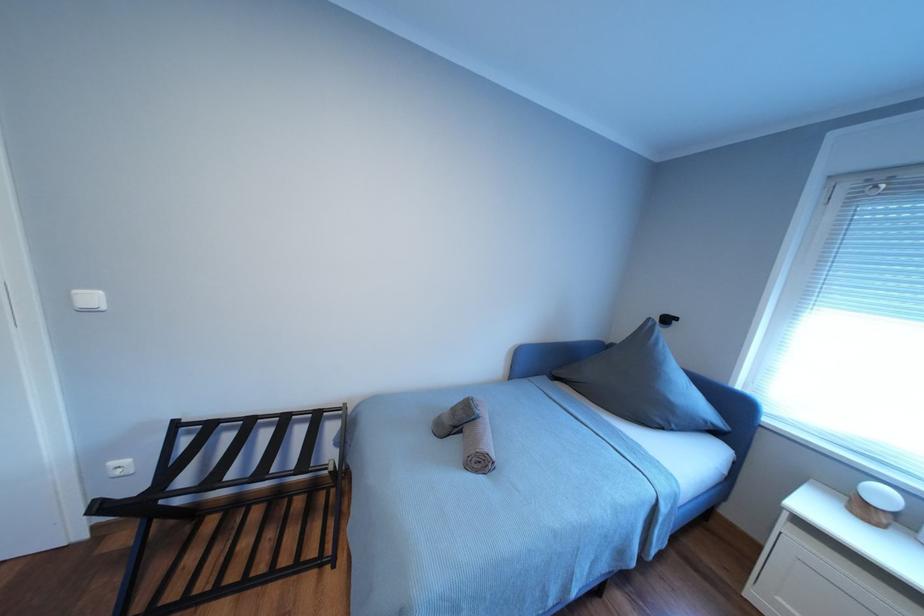
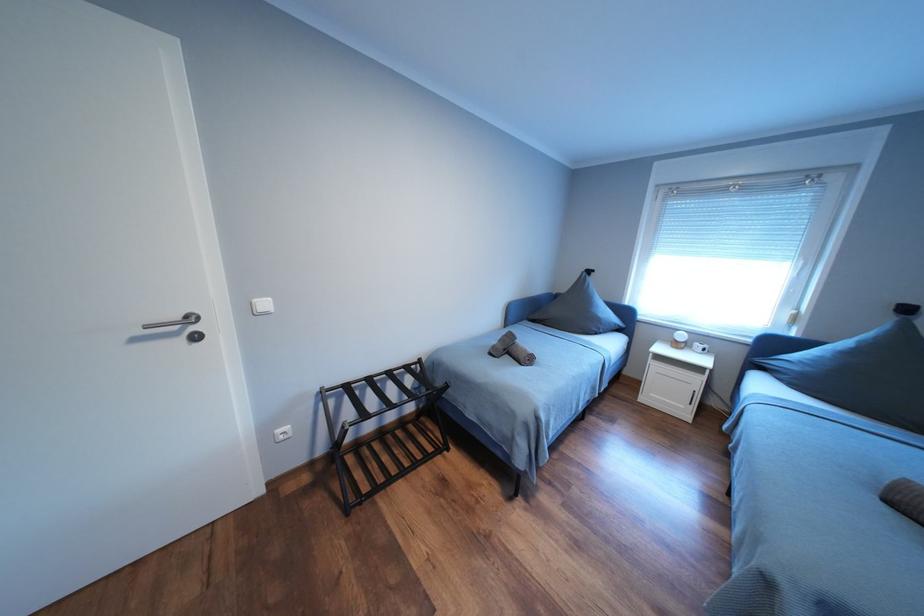
The images are taken continuously from a first-person perspective. In which direction are you moving?

The cameraman moved toward left, backward.